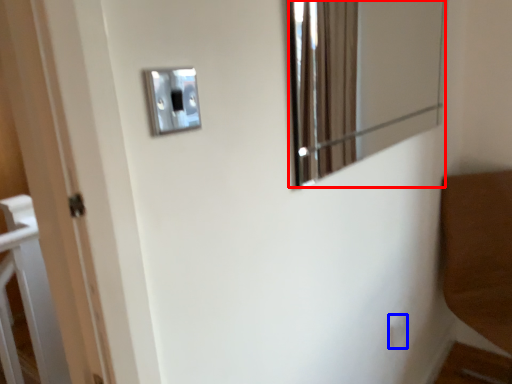
Question: Among these objects, which one is nearest to the camera, mirror (highlighted by a red box) or light switch (highlighted by a blue box)?

Choices:
 (A) mirror
 (B) light switch

Answer: (A)